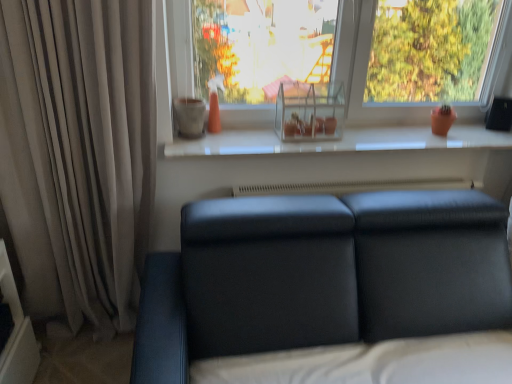
Question: In terms of size, does transparent glass shelf at upper center appear bigger or smaller than white glossy window sill at center?

Choices:
 (A) big
 (B) small

Answer: (A)

Question: In the image, is transparent glass shelf at upper center on the left side or the right side of white glossy window sill at center?

Choices:
 (A) left
 (B) right

Answer: (A)

Question: Considering the real-world distances, which object is closest to the matte black couch at lower center?

Choices:
 (A) beige fabric curtain at left
 (B) white glossy window sill at center
 (C) transparent glass shelf at upper center

Answer: (B)

Question: Estimate the real-world distances between objects in this image. Which object is farther from the matte black couch at lower center?

Choices:
 (A) beige fabric curtain at left
 (B) white glossy window sill at center
 (C) transparent glass shelf at upper center

Answer: (C)